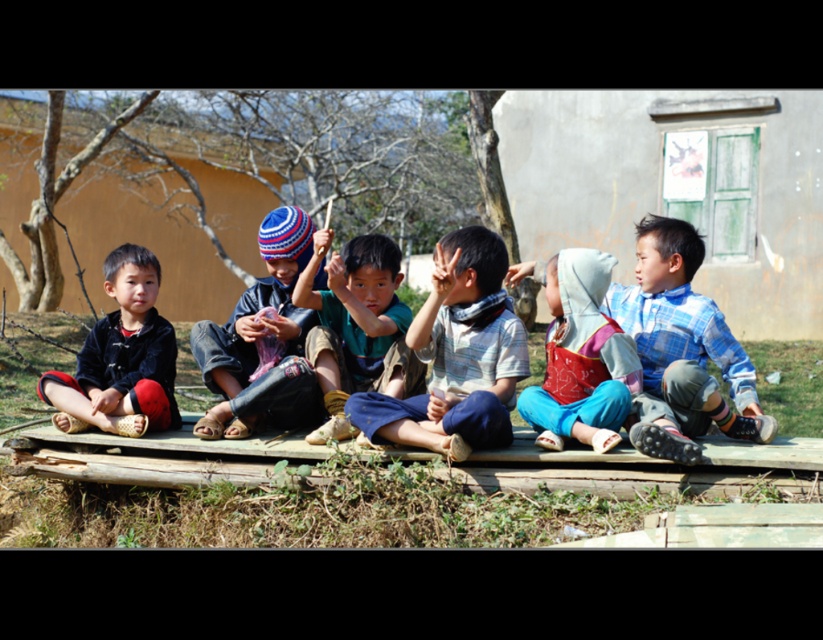
Question: Is knitted woolen hat at center positioned before matte black pants at left?

Choices:
 (A) no
 (B) yes

Answer: (B)

Question: Does blue plaid shirt at right have a greater width compared to matte black pants at left?

Choices:
 (A) yes
 (B) no

Answer: (A)

Question: Which of the following is the closest to the observer?

Choices:
 (A) blue cotton scarf at center
 (B) light blue cotton shirt at center

Answer: (A)

Question: Which of the following is the closest to the observer?

Choices:
 (A) blue cotton scarf at center
 (B) blue plaid shirt at right
 (C) light blue cotton shirt at center

Answer: (B)

Question: Which object is positioned farthest from the light blue cotton shirt at center?

Choices:
 (A) blue cotton scarf at center
 (B) blue plaid shirt at right

Answer: (B)

Question: Does light blue cotton shirt at center have a lesser width compared to knitted woolen hat at center?

Choices:
 (A) no
 (B) yes

Answer: (A)